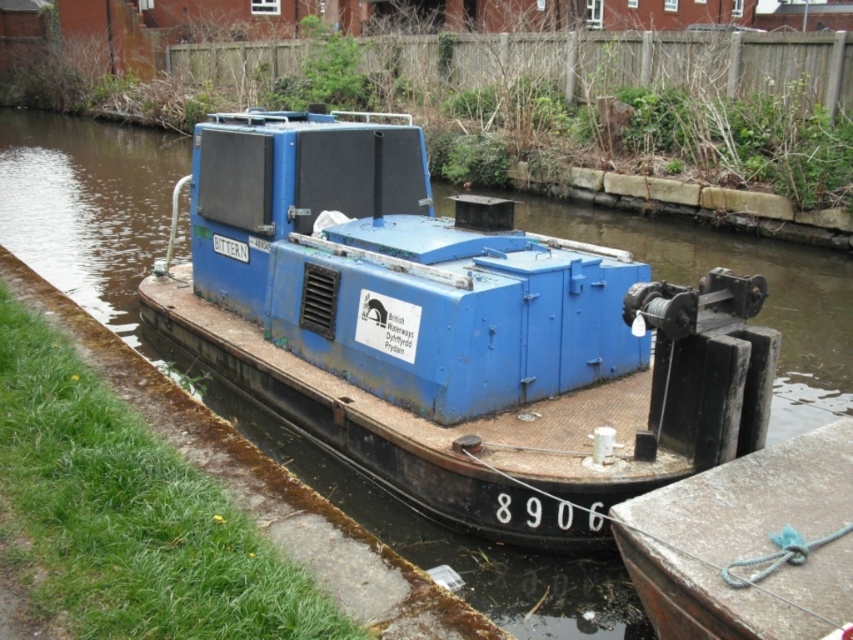
You are a delivery person needing to load a large crate onto the blue matte boat at center. The crate requires a minimum space of 10 meters in length. Can the rusty metal dock at lower right accommodate the crate before transferring it to the boat?

The blue matte boat at center is smaller than the rusty metal dock at lower right. Since the dock is larger, it can accommodate the crate as long as its length meets or exceeds 10 meters. However, the boat being smaller may not have enough space to hold the crate after transfer.

Based on the photo, you are a delivery drone flying over a canal. You need to land on the blue matte boat at center. What are the coordinates where you should aim your landing?

The blue matte boat at center is located at coordinates point [451,332], so you should aim for that point.